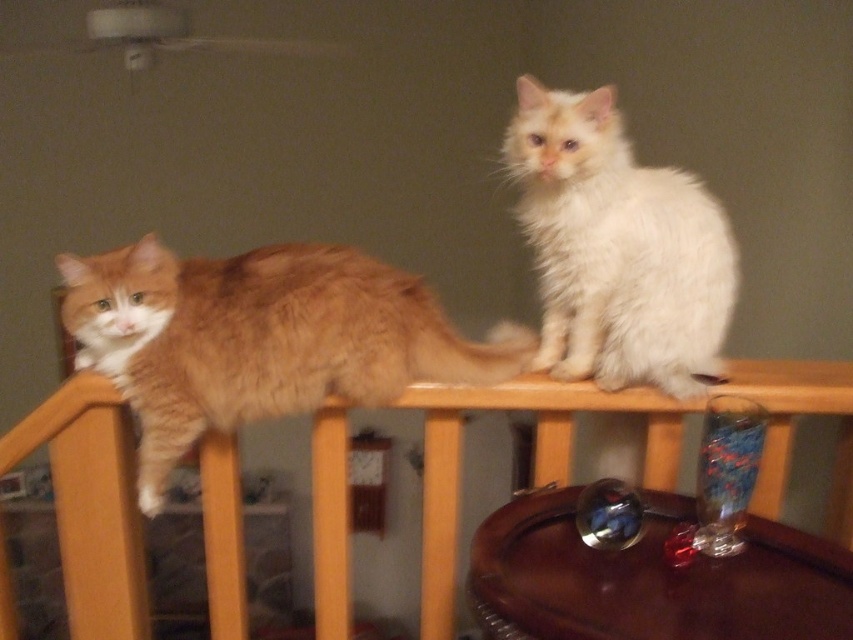
Between point (602, 228) and point (786, 554), which one is positioned in front?

Point (786, 554) is in front.

Consider the image. Is white fluffy cat at upper right smaller than transparent glass at lower right?

No.

You are a GUI agent. You are given a task and a screenshot of the screen. Output one action in this format:
    pyautogui.click(x=<x>, y=<y>)
    Task: Click on the white fluffy cat at upper right
    Image resolution: width=853 pixels, height=640 pixels.
    Given the screenshot: What is the action you would take?
    pyautogui.click(x=616, y=248)

Locate an element on the screen. The image size is (853, 640). white fluffy cat at upper right is located at coordinates (616, 248).

The width and height of the screenshot is (853, 640). What are the coordinates of `orange fluffy cat at upper left` in the screenshot? It's located at (260, 339).

Which is in front, point (358, 333) or point (709, 250)?

Point (709, 250)

This screenshot has height=640, width=853. What are the coordinates of `orange fluffy cat at upper left` in the screenshot? It's located at (260, 339).

Between point (433, 456) and point (485, 544), which one is positioned behind?

Positioned behind is point (433, 456).

The height and width of the screenshot is (640, 853). Identify the location of wooden balustrade at upper center. (90, 502).